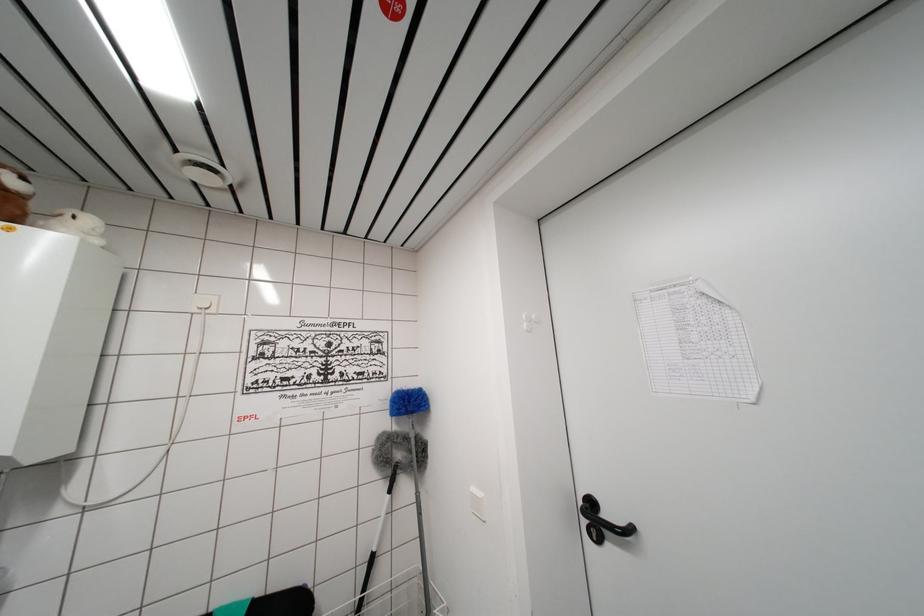
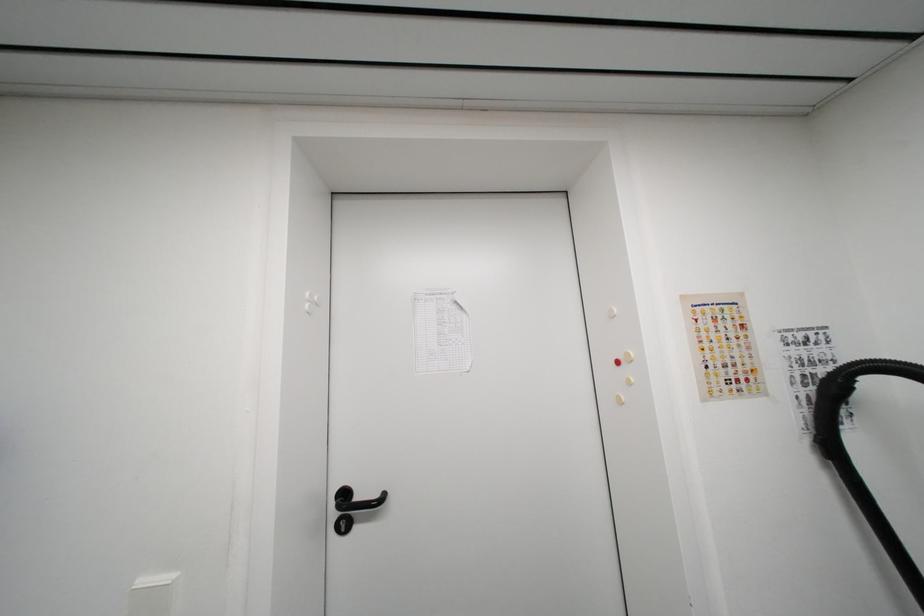
Question: The camera is either moving clockwise (left) or counter-clockwise (right) around the object. The first image is from the beginning of the video and the second image is from the end. Is the camera moving left or right when shooting the video?

Choices:
 (A) Left
 (B) Right

Answer: (A)